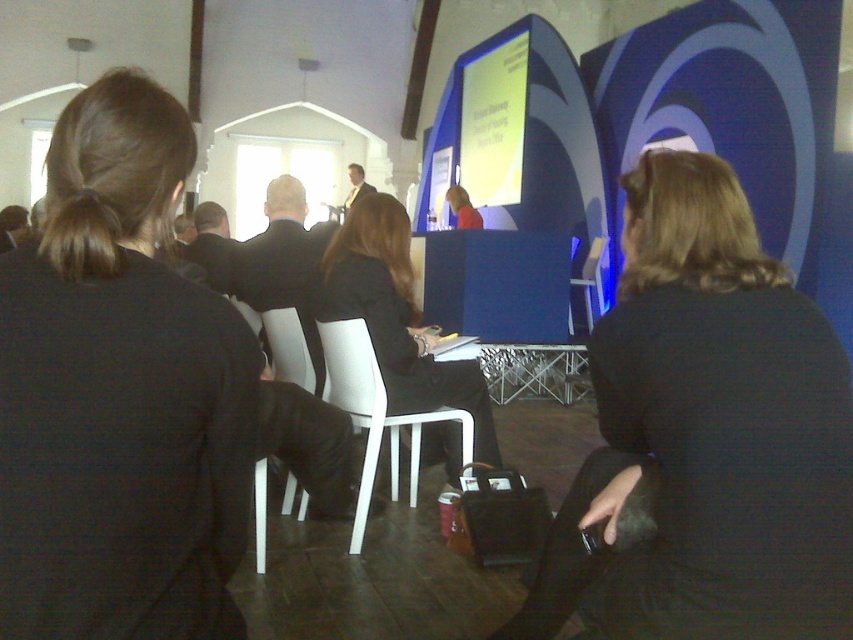
Can you confirm if black fabric jacket at center is positioned to the right of matte black jacket at center?

In fact, black fabric jacket at center is to the left of matte black jacket at center.

Is point (451, 404) in front of point (450, 193)?

Yes.

This screenshot has width=853, height=640. Find the location of `black fabric jacket at center`. black fabric jacket at center is located at coordinates (398, 317).

In the scene shown: Who is higher up, black fabric hair at upper left or dark blue fabric jacket at center?

black fabric hair at upper left is above.

Is point (155, 193) behind point (846, 424)?

No, (155, 193) is in front of (846, 424).

At what (x,y) coordinates should I click in order to perform the action: click on black fabric hair at upper left. Please return your answer as a coordinate pair (x, y). The image size is (853, 640). Looking at the image, I should click on [119, 394].

Which is in front, point (781, 461) or point (369, 352)?

Point (781, 461) is in front.

Does dark blue fabric jacket at center have a greater width compared to white plastic chair at center?

Correct, the width of dark blue fabric jacket at center exceeds that of white plastic chair at center.

Between point (634, 332) and point (352, 378), which one is positioned behind?

Point (352, 378)

Identify the location of dark blue fabric jacket at center. (706, 435).